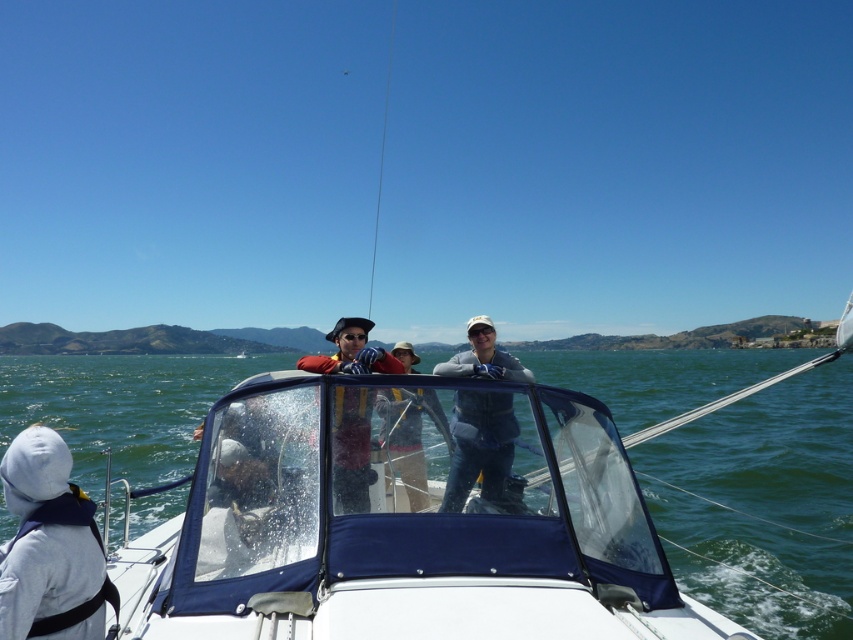
You are a photographer on the boat and need to choose between the white fleece jacket at lower left and the gray fabric jacket at center for a closeup shot. Which jacket should you select if you want to capture the texture of the fabric more clearly?

The white fleece jacket at lower left is smaller than the gray fabric jacket at center, so the gray fabric jacket at center would allow for a closer view and clearer texture details in the photograph.

You are a safety inspector on the boat and need to ensure that all life vests are visible to passengers. The gray fabric jacket at center and the matte orange life vest at center are both at the center of the boat. Which object is taller and might block the view of the other?

The gray fabric jacket at center is taller than the matte orange life vest at center, so it might block the view of the matte orange life vest at center.